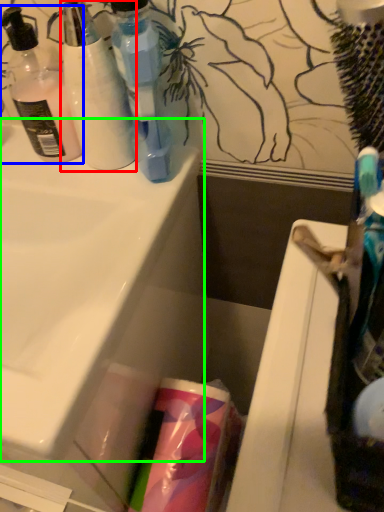
Question: Estimate the real-world distances between objects in this image. Which object is closer to bottle (highlighted by a red box), bottle (highlighted by a blue box) or sink (highlighted by a green box)?

Choices:
 (A) bottle
 (B) sink

Answer: (A)